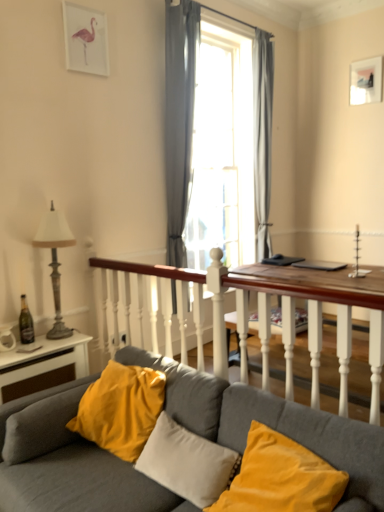
Question: From a real-world perspective, is matte white picture frame at upper right above or below gray sheer curtain at center, the 2th curtain positioned from the back?

Choices:
 (A) above
 (B) below

Answer: (A)

Question: Relative to gray sheer curtain at center, the 2th curtain positioned from the back, is matte white picture frame at upper right in front or behind?

Choices:
 (A) front
 (B) behind

Answer: (B)

Question: Considering the real-world distances, which object is closest to the gray fabric curtain at right, which appears as the first curtain when viewed from the right?

Choices:
 (A) velvet gray couch at lower left
 (B) gray sheer curtain at center, marked as the 2th curtain in a right-to-left arrangement
 (C) matte white picture frame at upper right
 (D) velvet yellow pillow at lower center, which appears as the 2th pillow when viewed from the left
 (E) velvet yellow pillow at center, which is the 1th pillow from left to right

Answer: (B)

Question: Which is nearer to the transparent glass window at center?

Choices:
 (A) velvet yellow pillow at center, which is counted as the second pillow, starting from the right
 (B) gray sheer curtain at center, the 2th curtain positioned from the back
 (C) metallic gray lamp at left
 (D) velvet gray couch at lower left
 (E) velvet yellow pillow at lower center, the first pillow when ordered from right to left

Answer: (B)